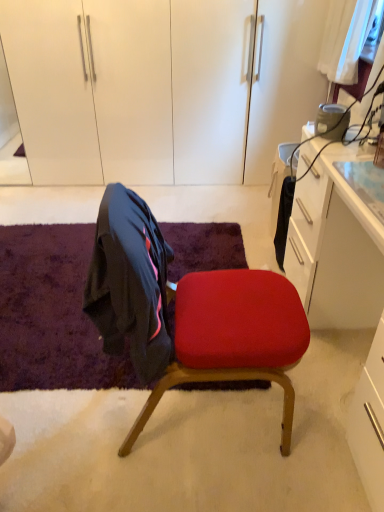
Question: Is white glossy dresser at upper center wider than velvety purple mat at lower left?

Choices:
 (A) yes
 (B) no

Answer: (B)

Question: From the image's perspective, is white glossy dresser at upper center located beneath velvety purple mat at lower left?

Choices:
 (A) no
 (B) yes

Answer: (A)

Question: Can you confirm if white glossy dresser at upper center is shorter than velvety purple mat at lower left?

Choices:
 (A) no
 (B) yes

Answer: (A)

Question: From a real-world perspective, is white glossy dresser at upper center on top of velvety purple mat at lower left?

Choices:
 (A) no
 (B) yes

Answer: (B)

Question: Does white glossy dresser at upper center have a smaller size compared to velvety purple mat at lower left?

Choices:
 (A) yes
 (B) no

Answer: (B)

Question: In terms of width, does white glossy dresser at upper center look wider or thinner when compared to velvety purple mat at lower left?

Choices:
 (A) thin
 (B) wide

Answer: (A)

Question: Is white glossy dresser at upper center taller or shorter than velvety purple mat at lower left?

Choices:
 (A) tall
 (B) short

Answer: (A)

Question: Would you say white glossy dresser at upper center is inside or outside velvety purple mat at lower left?

Choices:
 (A) inside
 (B) outside

Answer: (B)

Question: Based on their sizes in the image, would you say white glossy dresser at upper center is bigger or smaller than velvety purple mat at lower left?

Choices:
 (A) big
 (B) small

Answer: (A)

Question: Would you say velvet red chair at center is inside or outside white glossy dresser at upper center?

Choices:
 (A) inside
 (B) outside

Answer: (B)

Question: Looking at their shapes, would you say velvet red chair at center is wider or thinner than white glossy dresser at upper center?

Choices:
 (A) thin
 (B) wide

Answer: (A)

Question: Is velvet red chair at center to the left or to the right of white glossy dresser at upper center in the image?

Choices:
 (A) left
 (B) right

Answer: (B)

Question: Considering the positions of velvet red chair at center and white glossy dresser at upper center in the image, is velvet red chair at center bigger or smaller than white glossy dresser at upper center?

Choices:
 (A) big
 (B) small

Answer: (B)

Question: Is velvety purple mat at lower left spatially inside velvet red chair at center, or outside of it?

Choices:
 (A) inside
 (B) outside

Answer: (B)

Question: Visually, is velvety purple mat at lower left positioned to the left or to the right of velvet red chair at center?

Choices:
 (A) left
 (B) right

Answer: (A)